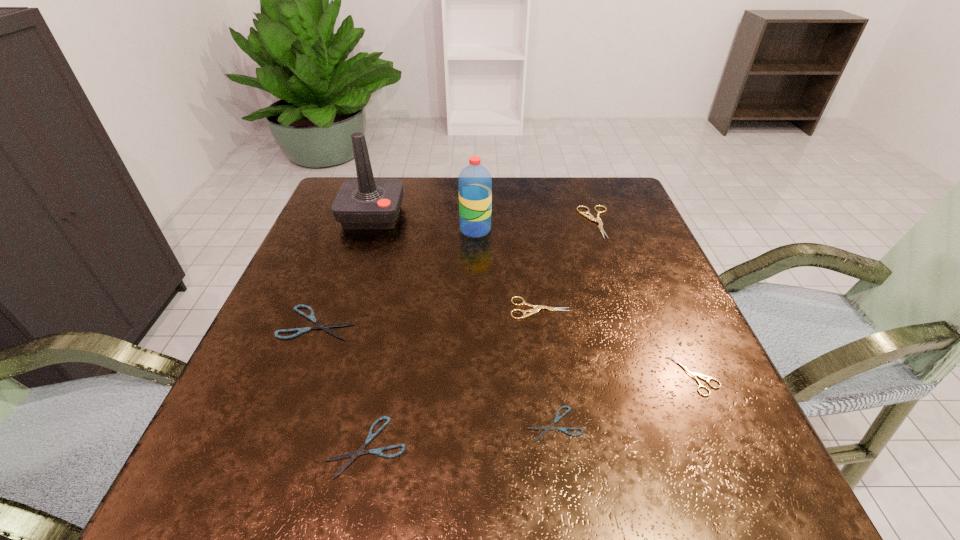
At what (x,y) coordinates should I click in order to perform the action: click on shears object that ranks as the closest to the farthest black shears. Please return your answer as a coordinate pair (x, y). Looking at the image, I should click on (360, 451).

I want to click on beige shears that is the second nearest to the leftmost shears, so click(590, 217).

Where is `the closest beige shears to the rightmost shears`? The image size is (960, 540). the closest beige shears to the rightmost shears is located at coordinates (536, 309).

Select which black shears is the third closest to the second nearest beige shears. Please provide its 2D coordinates. Your answer should be formatted as a tuple, i.e. [(x, y)], where the tuple contains the x and y coordinates of a point satisfying the conditions above.

[(311, 317)]

Find the location of a particular element. Image resolution: width=960 pixels, height=540 pixels. black shears that is the closest to the red water bottle is located at coordinates (311, 317).

In order to click on free space that satisfies the following two spatial constraints: 1. on the front label of the water bottle; 2. on the back side of the fifth shortest shears in this screenshot , I will do `click(474, 308)`.

Where is `vacant region that satisfies the following two spatial constraints: 1. on the front label of the fourth object from left to right; 2. on the back side of the shortest object`? vacant region that satisfies the following two spatial constraints: 1. on the front label of the fourth object from left to right; 2. on the back side of the shortest object is located at coordinates (473, 424).

Image resolution: width=960 pixels, height=540 pixels. What are the coordinates of `vacant space that satisfies the following two spatial constraints: 1. on the front label of the fifth shortest shears; 2. on the right side of the fourth object from left to right` in the screenshot? It's located at (474, 308).